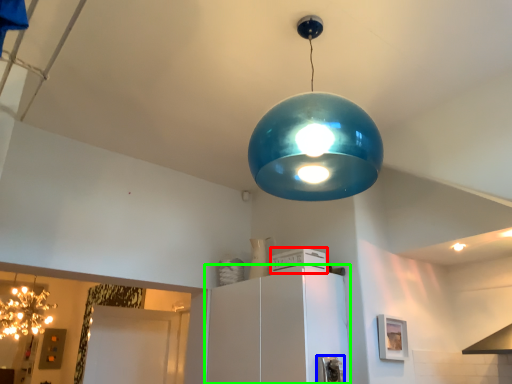
Question: Which object is the farthest from appliance (highlighted by a red box)? Choose among these: appliance (highlighted by a blue box) or cabinetry (highlighted by a green box).

Choices:
 (A) appliance
 (B) cabinetry

Answer: (A)